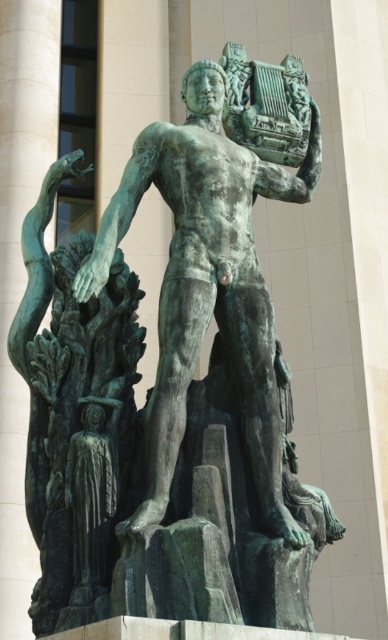
Does green patina statue at center have a larger size compared to green patina tree at left?

Actually, green patina statue at center might be smaller than green patina tree at left.

Does green patina statue at center have a greater height compared to green patina tree at left?

Indeed, green patina statue at center has a greater height compared to green patina tree at left.

Between point (190, 184) and point (84, 532), which one is positioned behind?

The point (190, 184) is more distant.

This screenshot has width=388, height=640. Find the location of `green patina statue at center`. green patina statue at center is located at coordinates (207, 284).